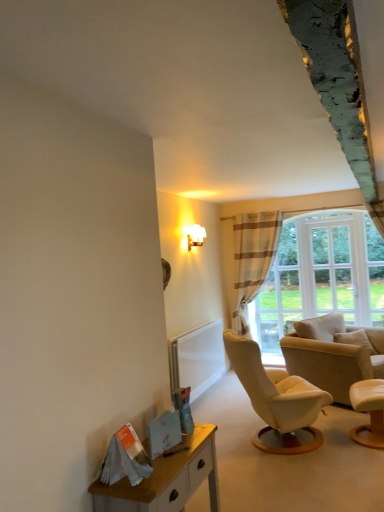
Where is `free point above wooden desk at lower left (from a real-world perspective)`? This screenshot has width=384, height=512. free point above wooden desk at lower left (from a real-world perspective) is located at coordinates (169, 451).